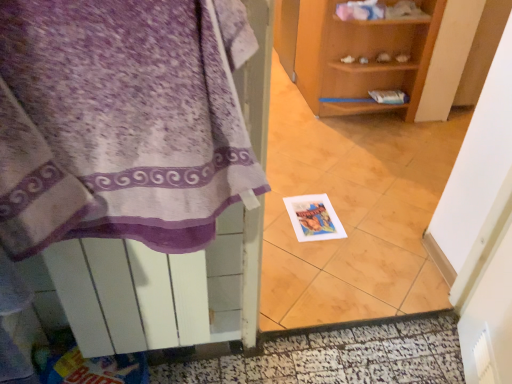
Question: Considering the positions of point (334, 357) and point (287, 316), is point (334, 357) closer or farther from the camera than point (287, 316)?

Choices:
 (A) farther
 (B) closer

Answer: (B)

Question: Is white glossy door at lower center to the left or to the right of white glossy tile at center in the image?

Choices:
 (A) right
 (B) left

Answer: (B)

Question: Which object is the closest to the white glossy tile at center?

Choices:
 (A) purple fabric towel at left
 (B) white paper postcard at center
 (C) white glossy door at lower center
 (D) wooden shelf at center

Answer: (B)

Question: Which is farther from the white glossy door at lower center?

Choices:
 (A) wooden shelf at center
 (B) purple fabric towel at left
 (C) white paper postcard at center
 (D) white glossy tile at center

Answer: (A)